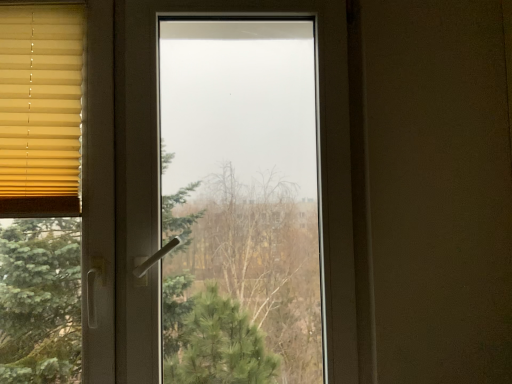
Describe the element at coordinates (158, 186) in the screenshot. This screenshot has width=512, height=384. I see `transparent glass window at center` at that location.

Locate an element on the screen. The width and height of the screenshot is (512, 384). transparent glass window at center is located at coordinates (158, 186).

The width and height of the screenshot is (512, 384). What do you see at coordinates (40, 109) in the screenshot? I see `yellow fabric blinds at left` at bounding box center [40, 109].

The image size is (512, 384). In order to click on yellow fabric blinds at left in this screenshot , I will do `click(40, 109)`.

At what (x,y) coordinates should I click in order to perform the action: click on transparent glass window at center. Please return your answer as a coordinate pair (x, y). Looking at the image, I should click on (158, 186).

Is transparent glass window at center to the left of yellow fabric blinds at left from the viewer's perspective?

No, transparent glass window at center is not to the left of yellow fabric blinds at left.

Which object is closer to the camera, transparent glass window at center or yellow fabric blinds at left?

Positioned in front is transparent glass window at center.

Which point is more forward, (x=321, y=284) or (x=25, y=38)?

Positioned in front is point (x=25, y=38).

From the image's perspective, which one is positioned lower, transparent glass window at center or yellow fabric blinds at left?

transparent glass window at center.

From a real-world perspective, which object stands above the other?

yellow fabric blinds at left.

Considering the relative sizes of transparent glass window at center and yellow fabric blinds at left in the image provided, is transparent glass window at center thinner than yellow fabric blinds at left?

No.

Considering the sizes of transparent glass window at center and yellow fabric blinds at left in the image, is transparent glass window at center taller or shorter than yellow fabric blinds at left?

Considering their sizes, transparent glass window at center has more height than yellow fabric blinds at left.

Between transparent glass window at center and yellow fabric blinds at left, which one has smaller size?

With smaller size is yellow fabric blinds at left.

Do you think transparent glass window at center is within yellow fabric blinds at left, or outside of it?

transparent glass window at center is outside yellow fabric blinds at left.

Are transparent glass window at center and yellow fabric blinds at left far apart?

That's not correct — transparent glass window at center is a little close to yellow fabric blinds at left.

Is transparent glass window at center positioned with its back to yellow fabric blinds at left?

Correct, transparent glass window at center is looking away from yellow fabric blinds at left.

What's the angular difference between transparent glass window at center and yellow fabric blinds at left's facing directions?

The angular difference between transparent glass window at center and yellow fabric blinds at left is 0.00112 degrees.

Locate an element on the screen. The image size is (512, 384). window blind on the left side of transparent glass window at center is located at coordinates (40, 109).

Which object is positioned more to the right, yellow fabric blinds at left or transparent glass window at center?

Positioned to the right is transparent glass window at center.

Is yellow fabric blinds at left in front of or behind transparent glass window at center in the image?

yellow fabric blinds at left is positioned farther from the viewer than transparent glass window at center.

Is point (52, 189) more distant than point (325, 42)?

That is False.

From the image's perspective, which object appears higher, yellow fabric blinds at left or transparent glass window at center?

yellow fabric blinds at left appears higher in the image.

From a real-world perspective, is yellow fabric blinds at left positioned above or below transparent glass window at center?

In terms of real-world spatial position, yellow fabric blinds at left is above transparent glass window at center.

Which object is thinner, yellow fabric blinds at left or transparent glass window at center?

With smaller width is yellow fabric blinds at left.

From their relative heights in the image, would you say yellow fabric blinds at left is taller or shorter than transparent glass window at center?

yellow fabric blinds at left is shorter than transparent glass window at center.

Looking at this image, which of these two, yellow fabric blinds at left or transparent glass window at center, is bigger?

With larger size is transparent glass window at center.

Is yellow fabric blinds at left located outside transparent glass window at center?

Actually, yellow fabric blinds at left is at least partially inside transparent glass window at center.

Does yellow fabric blinds at left touch transparent glass window at center?

No, yellow fabric blinds at left is not with transparent glass window at center.

Is yellow fabric blinds at left looking in the opposite direction of transparent glass window at center?

Yes.

Consider the image. How different are the orientations of yellow fabric blinds at left and transparent glass window at center in degrees?

They differ by 0.00112 degrees in their facing directions.

Locate an element on the screen. window lying in front of the yellow fabric blinds at left is located at coordinates (158, 186).

I want to click on window below the yellow fabric blinds at left (from a real-world perspective), so click(x=158, y=186).

This screenshot has height=384, width=512. What are the coordinates of `window in front of the yellow fabric blinds at left` in the screenshot? It's located at (158, 186).